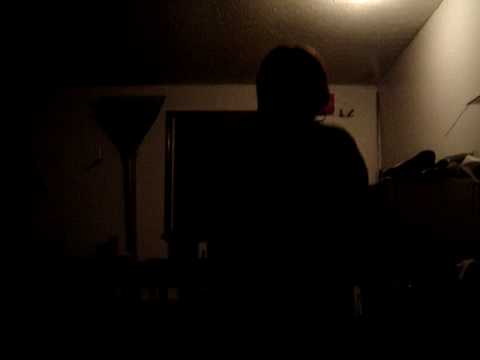
At what (x,y) coordinates should I click in order to perform the action: click on lamp. Please return your answer as a coordinate pair (x, y). Looking at the image, I should click on (135, 120).